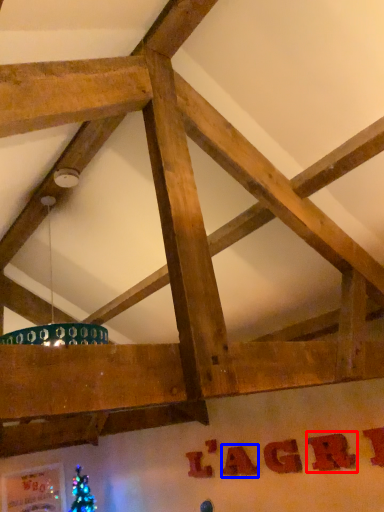
Question: Among these objects, which one is nearest to the camera, letter (highlighted by a red box) or letter (highlighted by a blue box)?

Choices:
 (A) letter
 (B) letter

Answer: (A)